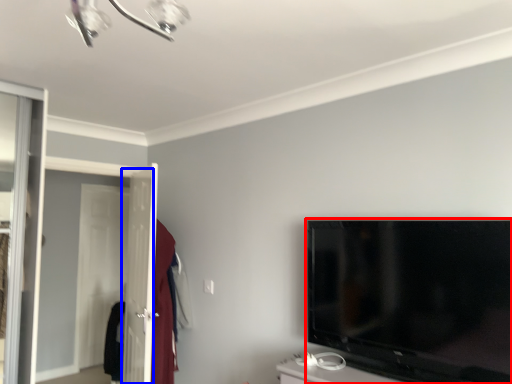
Question: Among these objects, which one is nearest to the camera, television (highlighted by a red box) or screen door (highlighted by a blue box)?

Choices:
 (A) television
 (B) screen door

Answer: (A)